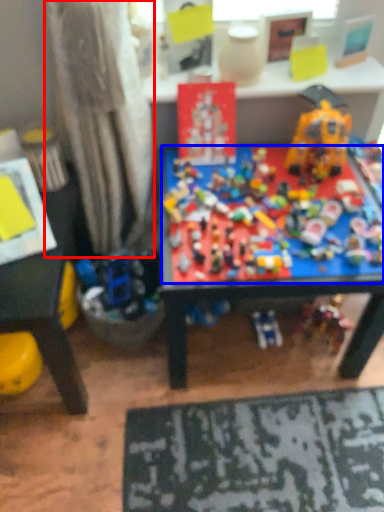
Question: Which point is further to the camera, curtain (highlighted by a red box) or toy (highlighted by a blue box)?

Choices:
 (A) curtain
 (B) toy

Answer: (B)